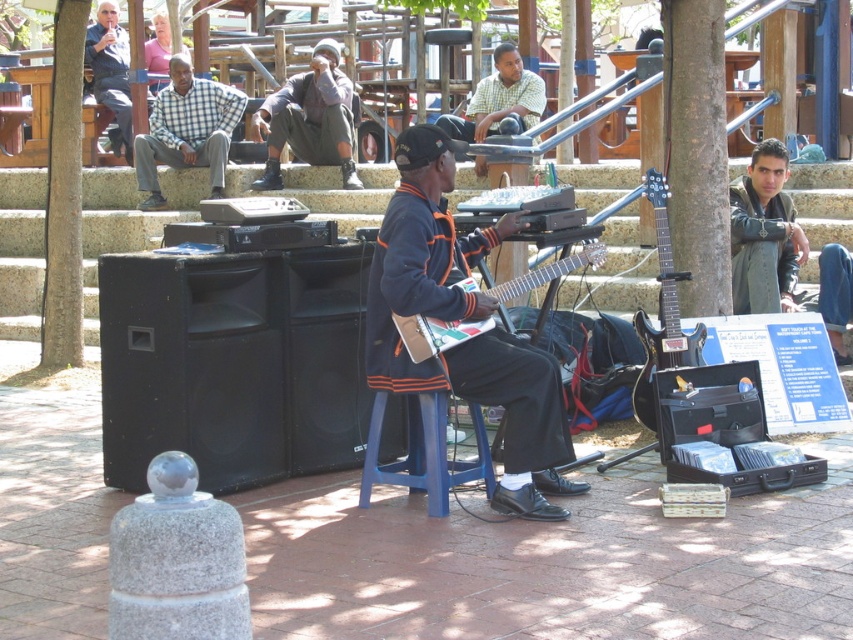
Does black glossy electric guitar at center appear under matte black guitar at center?

Yes, black glossy electric guitar at center is below matte black guitar at center.

Is point (662, 348) farther from camera compared to point (482, 324)?

Yes.

Where is `black glossy electric guitar at center`? black glossy electric guitar at center is located at coordinates (662, 314).

Who is taller, orange fabric jacket at center or dark brown leather jacket at upper right?

orange fabric jacket at center is taller.

Who is lower down, orange fabric jacket at center or dark brown leather jacket at upper right?

orange fabric jacket at center is below.

Which is in front, point (527, 465) or point (734, 182)?

Point (527, 465) is in front.

Locate an element on the screen. The image size is (853, 640). orange fabric jacket at center is located at coordinates (457, 320).

Is point (329, 72) positioned behind point (215, 160)?

Yes, point (329, 72) is farther from viewer.

Is dark blue uniform at center further to the viewer compared to checkered fabric shirt at upper left?

No, it is not.

Where is `dark blue uniform at center`? The image size is (853, 640). dark blue uniform at center is located at coordinates (310, 120).

Locate an element on the screen. The height and width of the screenshot is (640, 853). dark blue uniform at center is located at coordinates (310, 120).